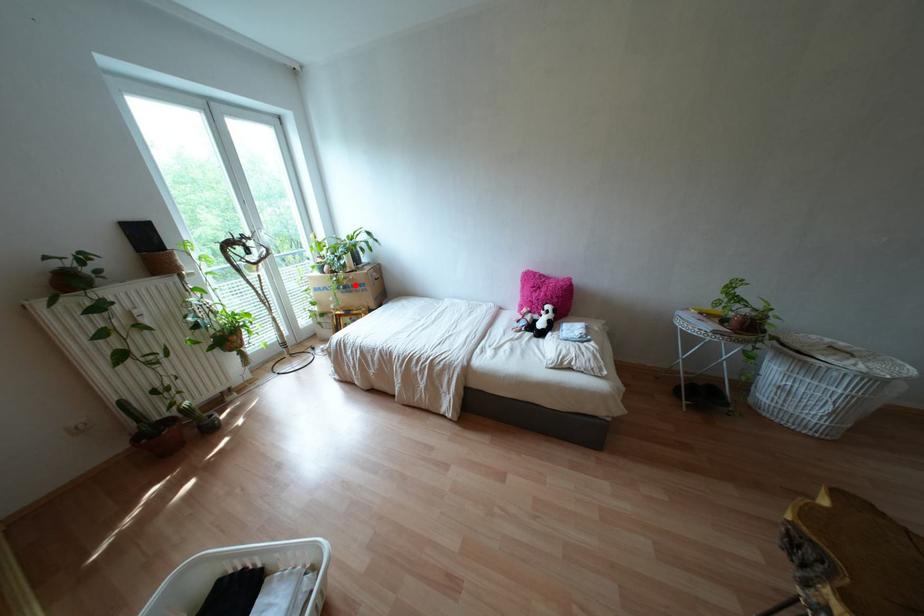
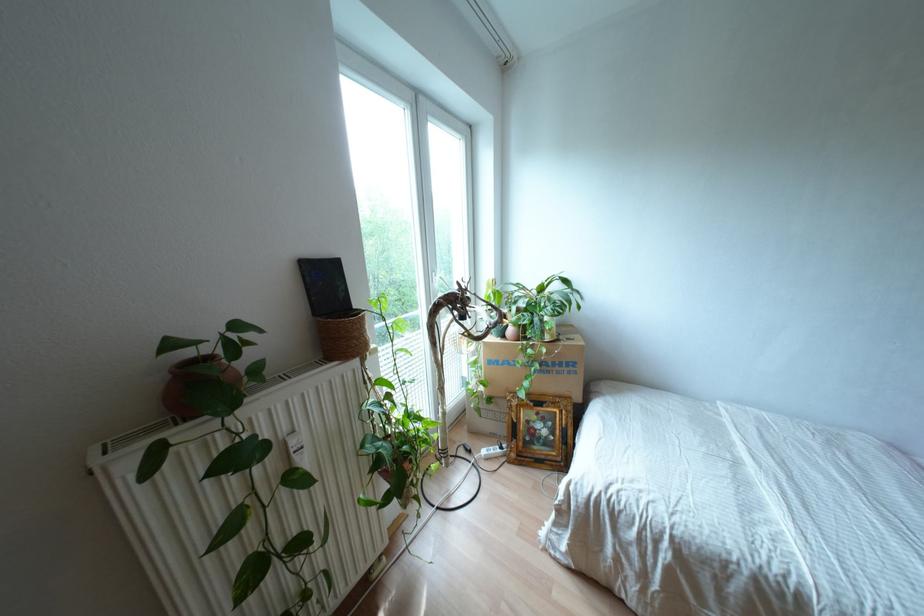
Question: I am providing you with two images of the same scene from different viewpoints. A red point is shown in image1. For the corresponding object point in image2, is it positioned nearer or farther from the camera?

Choices:
 (A) Nearer
 (B) Farther

Answer: (B)